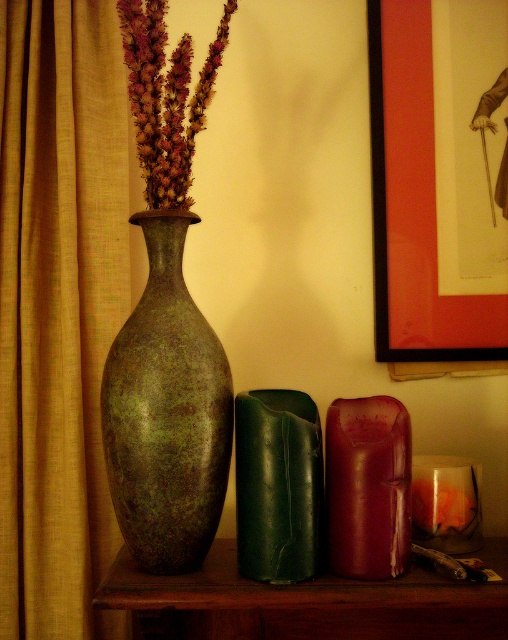
Between point (79, 460) and point (183, 234), which one is positioned behind?

Positioned behind is point (79, 460).

Is point (80, 276) less distant than point (155, 214)?

No.

Who is more forward, (94, 404) or (187, 353)?

Point (187, 353) is in front.

This screenshot has height=640, width=508. I want to click on gold textured curtain at left, so click(58, 308).

Which is in front, point (91, 451) or point (281, 621)?

Positioned in front is point (281, 621).

Does gold textured curtain at left have a greater width compared to wooden shelf at center?

No.

Where is `gold textured curtain at left`? gold textured curtain at left is located at coordinates (58, 308).

Does matte red picture frame at upper right appear on the left side of green matte vase at center?

In fact, matte red picture frame at upper right is to the right of green matte vase at center.

Is matte red picture frame at upper right positioned behind green matte vase at center?

Yes, it is behind green matte vase at center.

This screenshot has height=640, width=508. I want to click on matte red picture frame at upper right, so click(x=414, y=204).